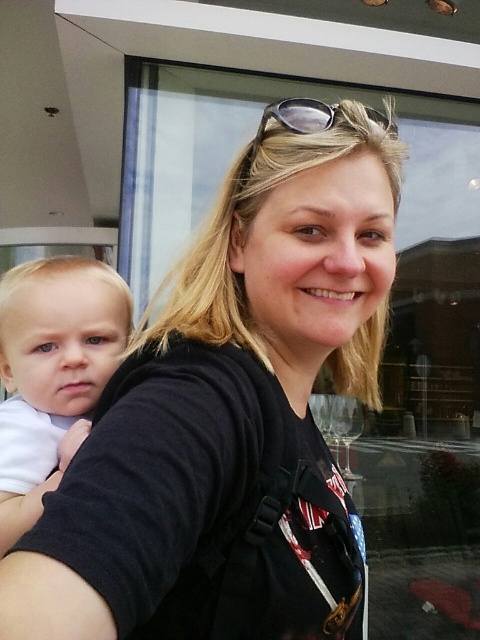
Consider the image. Which of these two, white soft baby at left or sunglasses at center, stands shorter?

Standing shorter between the two is sunglasses at center.

Who is positioned more to the left, white soft baby at left or sunglasses at center?

Positioned to the left is white soft baby at left.

Is point (1, 486) more distant than point (295, 99)?

Yes, it is behind point (295, 99).

Find the location of a particular element. The image size is (480, 640). white soft baby at left is located at coordinates (57, 362).

Can you confirm if black matte shirt at center is shorter than white soft baby at left?

No.

Is black matte shirt at center closer to camera compared to white soft baby at left?

Yes, it is.

Does point (173, 486) come behind point (74, 372)?

No, (173, 486) is closer to viewer.

This screenshot has height=640, width=480. In order to click on black matte shirt at center in this screenshot , I will do `click(232, 413)`.

Does black matte shirt at center appear on the left side of sunglasses at center?

Yes, black matte shirt at center is to the left of sunglasses at center.

Does black matte shirt at center have a greater width compared to sunglasses at center?

Yes, black matte shirt at center is wider than sunglasses at center.

You are a GUI agent. You are given a task and a screenshot of the screen. Output one action in this format:
    pyautogui.click(x=<x>, y=<y>)
    Task: Click on the black matte shirt at center
    The width and height of the screenshot is (480, 640).
    Given the screenshot: What is the action you would take?
    pyautogui.click(x=232, y=413)